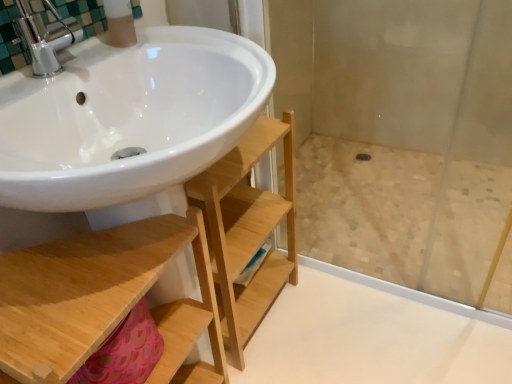
Question: From a real-world perspective, is matte plastic soap dispenser at upper left physically located above or below transparent glass shower door at center?

Choices:
 (A) below
 (B) above

Answer: (B)

Question: Visually, is matte plastic soap dispenser at upper left positioned to the left or to the right of transparent glass shower door at center?

Choices:
 (A) left
 (B) right

Answer: (A)

Question: Which of these objects is positioned closest to the matte plastic soap dispenser at upper left?

Choices:
 (A) natural wood shelf at lower left
 (B) transparent glass shower door at center

Answer: (A)

Question: Which is farther from the matte plastic soap dispenser at upper left?

Choices:
 (A) natural wood shelf at lower left
 (B) transparent glass shower door at center

Answer: (B)